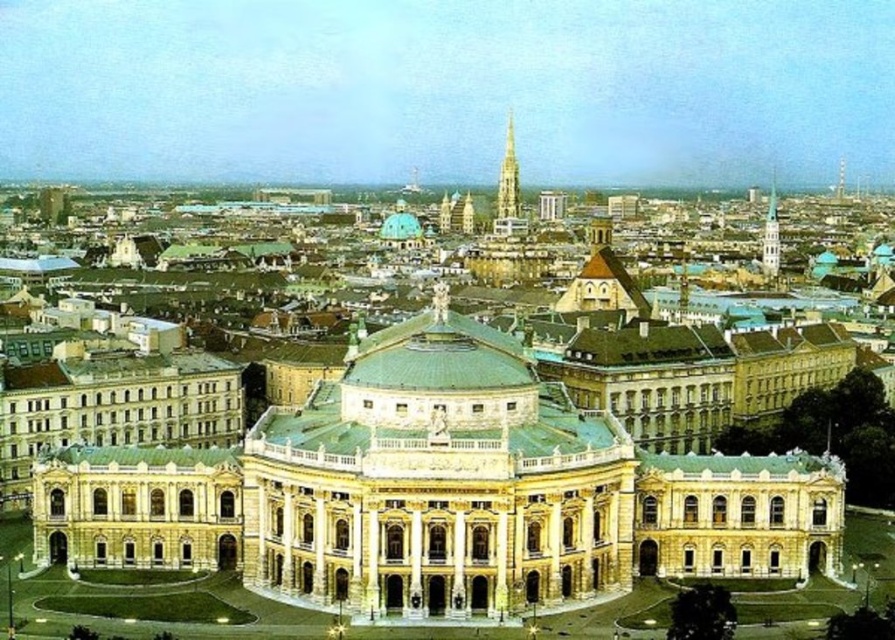
Does golden spire at center appear over gold textured spire at upper right?

Yes, golden spire at center is above gold textured spire at upper right.

Between point (503, 216) and point (773, 196), which one is positioned in front?

Positioned in front is point (503, 216).

The image size is (895, 640). In order to click on golden spire at center in this screenshot , I will do `click(508, 177)`.

Between beige stone palace at center and gold textured spire at upper right, which one appears on the left side from the viewer's perspective?

beige stone palace at center is more to the left.

Which of these two, beige stone palace at center or gold textured spire at upper right, stands shorter?

With less height is beige stone palace at center.

Which is behind, point (584, 572) or point (766, 214)?

The point (766, 214) is more distant.

The width and height of the screenshot is (895, 640). Find the location of `beige stone palace at center`. beige stone palace at center is located at coordinates (439, 493).

Can you confirm if beige stone palace at center is shorter than golden spire at center?

Yes.

Does beige stone palace at center have a greater width compared to golden spire at center?

Yes, beige stone palace at center is wider than golden spire at center.

Between point (433, 298) and point (499, 208), which one is positioned in front?

Point (433, 298) is more forward.

This screenshot has height=640, width=895. Identify the location of beige stone palace at center. (439, 493).